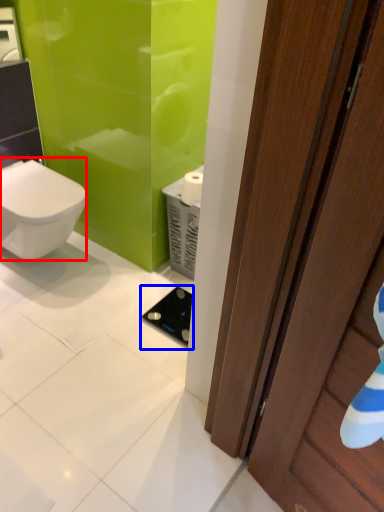
Question: Which point is closer to the camera, bidet (highlighted by a red box) or appliance (highlighted by a blue box)?

Choices:
 (A) bidet
 (B) appliance

Answer: (A)